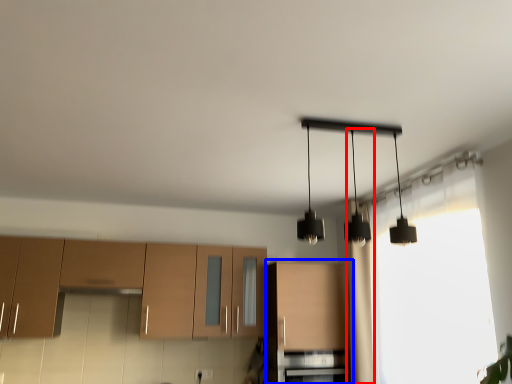
Question: Which of the following is the farthest to the observer, curtain (highlighted by a red box) or cabinetry (highlighted by a blue box)?

Choices:
 (A) curtain
 (B) cabinetry

Answer: (B)